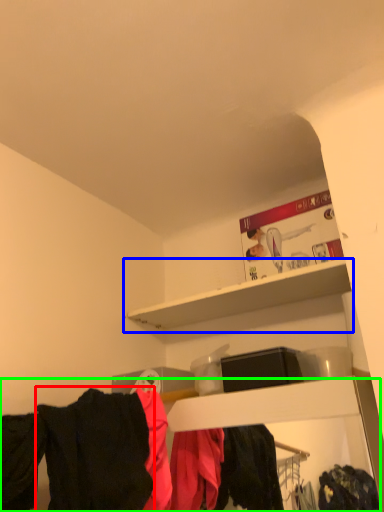
Question: Considering the real-world distances, which object is farthest from clothing (highlighted by a red box)? shelf (highlighted by a blue box) or closet (highlighted by a green box)?

Choices:
 (A) shelf
 (B) closet

Answer: (A)